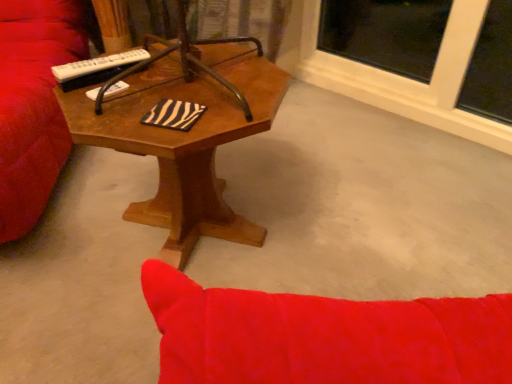
Locate an element on the screen. vacant region to the right of white plastic remote at upper left is located at coordinates (169, 76).